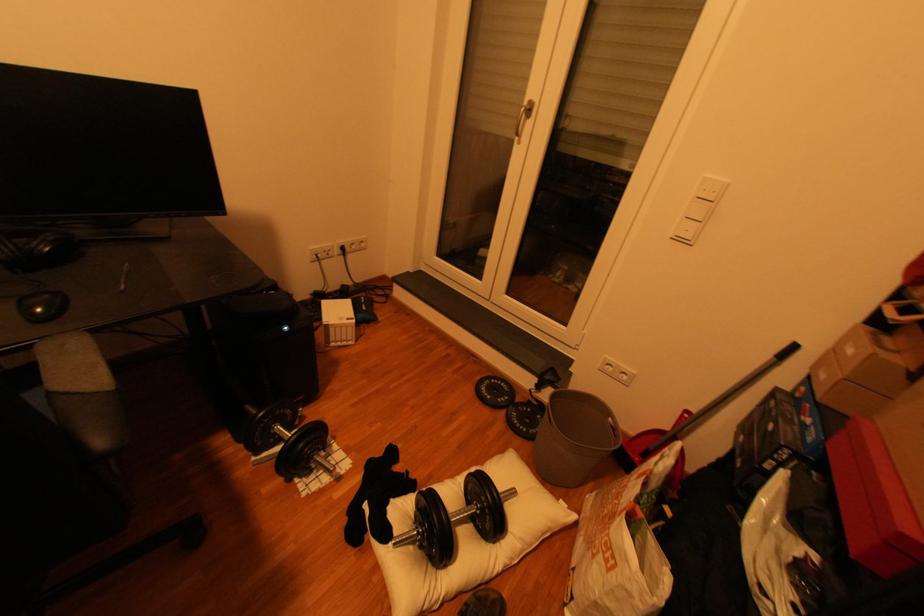
Where would you click the black computer mouse? Please return your answer as a coordinate pair (x, y).

(42, 305)